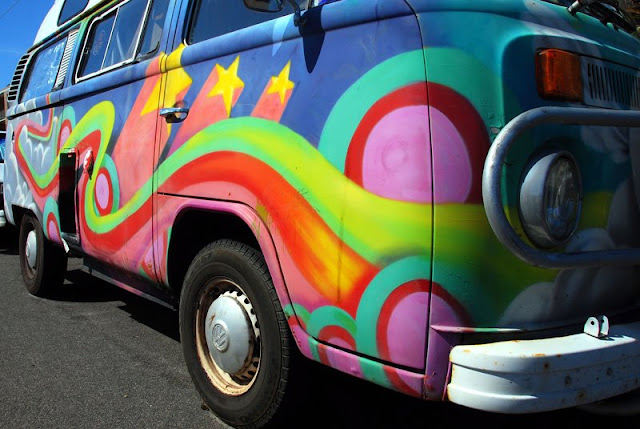
Where is `vent`? vent is located at coordinates (13, 85), (65, 61).